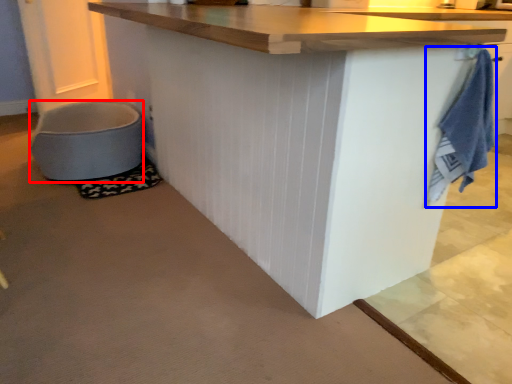
Question: Which point is further to the camera, toilet bowl (highlighted by a red box) or bath towel (highlighted by a blue box)?

Choices:
 (A) toilet bowl
 (B) bath towel

Answer: (A)